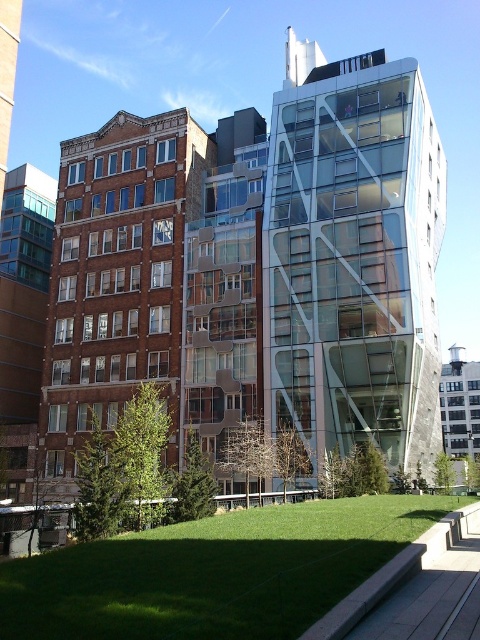
Who is more forward, (423, 113) or (294, 630)?

Point (294, 630) is more forward.

Does transparent glass building at center appear on the left side of green grass at lower center?

In fact, transparent glass building at center is to the right of green grass at lower center.

You are a GUI agent. You are given a task and a screenshot of the screen. Output one action in this format:
    pyautogui.click(x=<x>, y=<y>)
    Task: Click on the transparent glass building at center
    
    Given the screenshot: What is the action you would take?
    pyautogui.click(x=352, y=257)